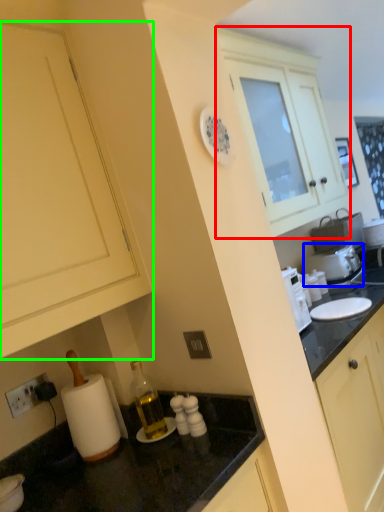
Question: Which is nearer to the cabinetry (highlighted by a red box)? appliance (highlighted by a blue box) or cabinetry (highlighted by a green box).

Choices:
 (A) appliance
 (B) cabinetry

Answer: (A)